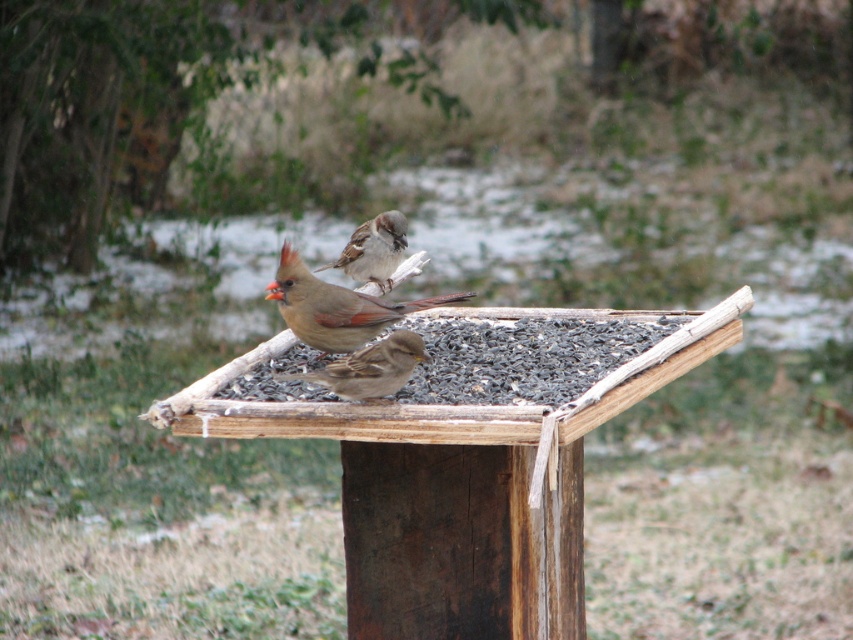
Can you confirm if brown feathered sparrow at center is wider than brown matte sparrow at center?

Yes, brown feathered sparrow at center is wider than brown matte sparrow at center.

Looking at this image, can you confirm if brown feathered sparrow at center is taller than brown matte sparrow at center?

Incorrect, brown feathered sparrow at center's height is not larger of brown matte sparrow at center's.

Is point (360, 368) more distant than point (376, 275)?

No, it is in front of (376, 275).

Where is `brown feathered sparrow at center`? brown feathered sparrow at center is located at coordinates click(x=369, y=369).

Describe the element at coordinates (334, 307) in the screenshot. This screenshot has width=853, height=640. I see `brown speckled sparrow at center` at that location.

The image size is (853, 640). I want to click on brown speckled sparrow at center, so click(x=334, y=307).

Identify the location of brown speckled sparrow at center. The width and height of the screenshot is (853, 640). (334, 307).

I want to click on brown speckled sparrow at center, so click(334, 307).

Which is more to the left, brown speckled sparrow at center or brown feathered sparrow at center?

brown feathered sparrow at center

Can you confirm if brown speckled sparrow at center is thinner than brown feathered sparrow at center?

No, brown speckled sparrow at center is not thinner than brown feathered sparrow at center.

The image size is (853, 640). Describe the element at coordinates (334, 307) in the screenshot. I see `brown speckled sparrow at center` at that location.

The height and width of the screenshot is (640, 853). What are the coordinates of `brown speckled sparrow at center` in the screenshot? It's located at (334, 307).